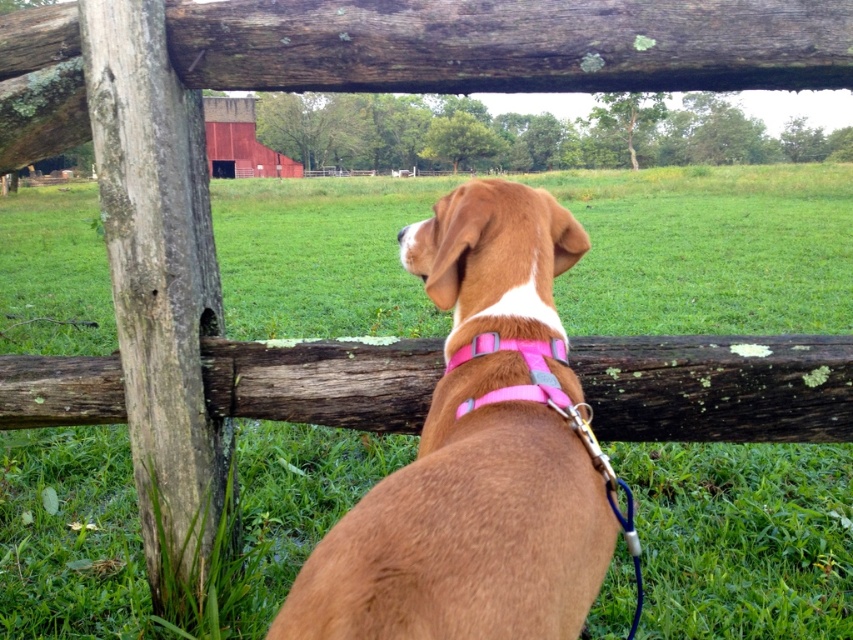
You are a farmer who wants to secure the pink fabric neckband at center to the weathered wood log at center. Given their sizes, will the neckband be able to wrap around the log completely?

The weathered wood log at center is larger in size than the pink fabric neckband at center, so the neckband may not be long enough to wrap around the log completely.

You are a farmer checking the fence. You see the brown matte dog at center and the weathered wood log at center. Which object is closer to you?

The brown matte dog at center is closer to you because it is in front of the weathered wood log at center.